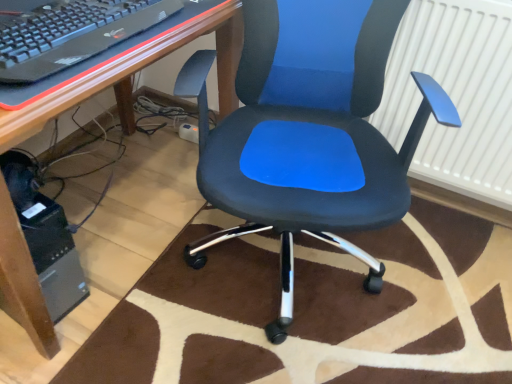
The width and height of the screenshot is (512, 384). In order to click on vacant location behind black plastic computer tower at lower left in this screenshot , I will do `click(98, 247)`.